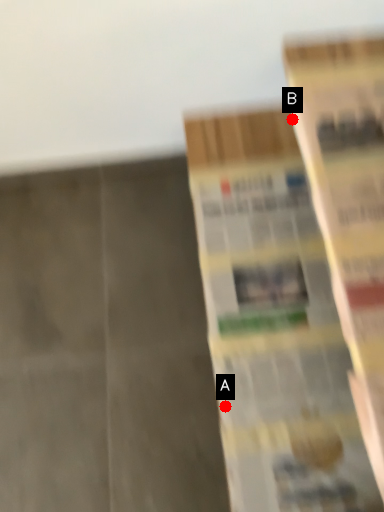
Question: Two points are circled on the image, labeled by A and B beside each circle. Among these points, which one is nearest to the camera?

Choices:
 (A) A is closer
 (B) B is closer

Answer: (A)